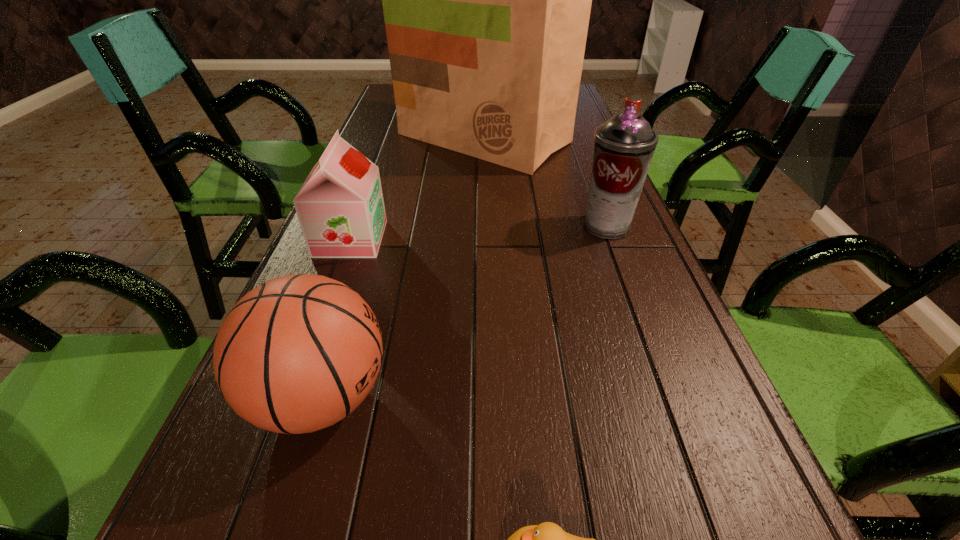
This screenshot has height=540, width=960. I want to click on free space that is in between the second tallest object and the second nearest object, so coord(464,312).

Find the location of `object that can be found as the third closest to the soya milk`. object that can be found as the third closest to the soya milk is located at coordinates (624, 145).

Identify which object is located as the second nearest to the tallest object. Please provide its 2D coordinates. Your answer should be formatted as a tuple, i.e. [(x, y)], where the tuple contains the x and y coordinates of a point satisfying the conditions above.

[(340, 207)]